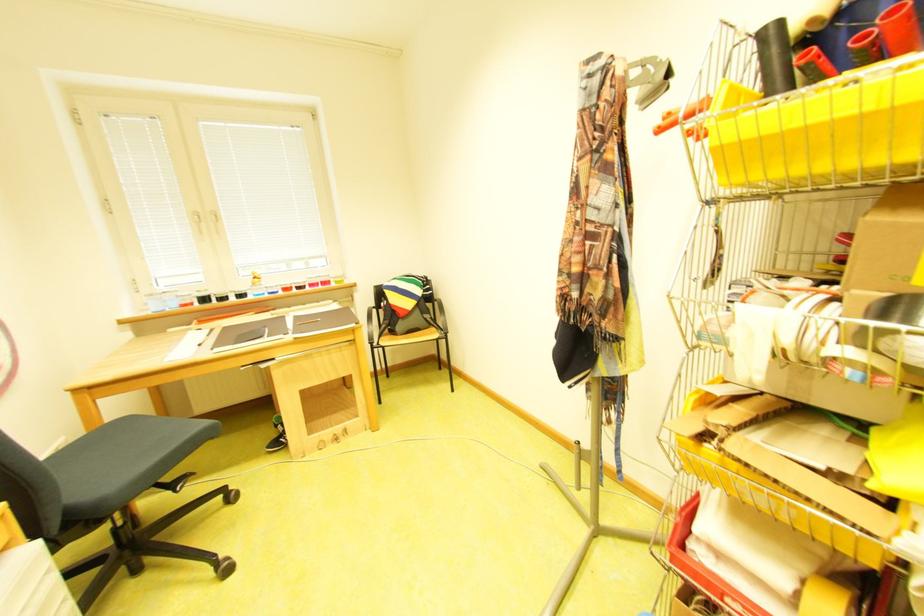
What do you see at coordinates (408, 337) in the screenshot?
I see `a chair sitting surface` at bounding box center [408, 337].